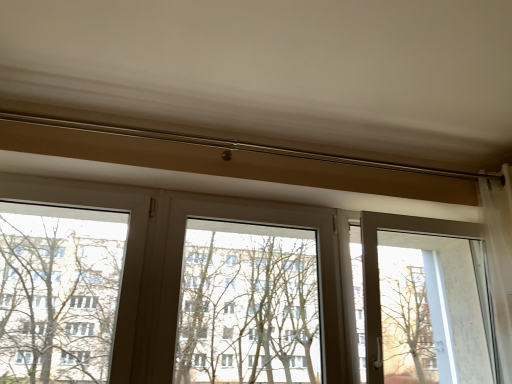
Question: Is green leafy tree at left shorter than transparent glass screen door at right?

Choices:
 (A) no
 (B) yes

Answer: (B)

Question: Is green leafy tree at left smaller than transparent glass screen door at right?

Choices:
 (A) yes
 (B) no

Answer: (A)

Question: Considering the relative sizes of green leafy tree at left and transparent glass screen door at right in the image provided, is green leafy tree at left wider than transparent glass screen door at right?

Choices:
 (A) no
 (B) yes

Answer: (A)

Question: Can you confirm if green leafy tree at left is bigger than transparent glass screen door at right?

Choices:
 (A) yes
 (B) no

Answer: (B)

Question: Is green leafy tree at left oriented away from transparent glass screen door at right?

Choices:
 (A) yes
 (B) no

Answer: (B)

Question: Considering the positions of transparent glass screen door at right and transparent plastic window screen at center in the image, is transparent glass screen door at right taller or shorter than transparent plastic window screen at center?

Choices:
 (A) tall
 (B) short

Answer: (A)

Question: Is transparent glass screen door at right wider or thinner than transparent plastic window screen at center?

Choices:
 (A) thin
 (B) wide

Answer: (B)

Question: Visually, is transparent glass screen door at right positioned to the left or to the right of transparent plastic window screen at center?

Choices:
 (A) right
 (B) left

Answer: (A)

Question: Is transparent glass screen door at right spatially inside transparent plastic window screen at center, or outside of it?

Choices:
 (A) outside
 (B) inside

Answer: (A)

Question: Considering the positions of transparent plastic window screen at center and green leafy tree at left in the image, is transparent plastic window screen at center taller or shorter than green leafy tree at left?

Choices:
 (A) tall
 (B) short

Answer: (B)

Question: From a real-world perspective, is transparent plastic window screen at center physically located above or below green leafy tree at left?

Choices:
 (A) below
 (B) above

Answer: (A)

Question: From the image's perspective, is transparent plastic window screen at center located above or below green leafy tree at left?

Choices:
 (A) above
 (B) below

Answer: (B)

Question: Based on their sizes in the image, would you say transparent plastic window screen at center is bigger or smaller than green leafy tree at left?

Choices:
 (A) big
 (B) small

Answer: (A)

Question: From the image's perspective, is transparent plastic window screen at center above or below transparent glass screen door at right?

Choices:
 (A) below
 (B) above

Answer: (B)

Question: Which is correct: transparent plastic window screen at center is inside transparent glass screen door at right, or outside of it?

Choices:
 (A) outside
 (B) inside

Answer: (A)